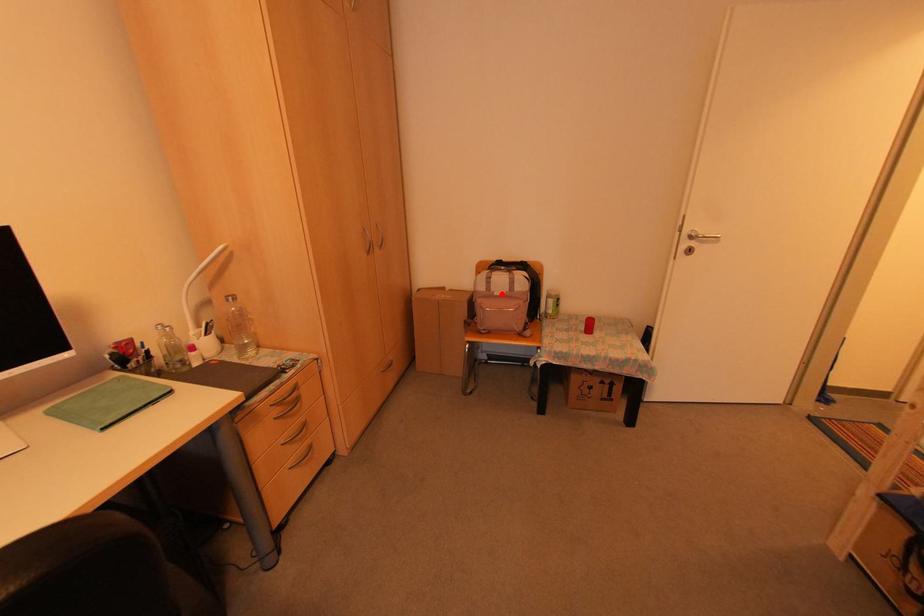
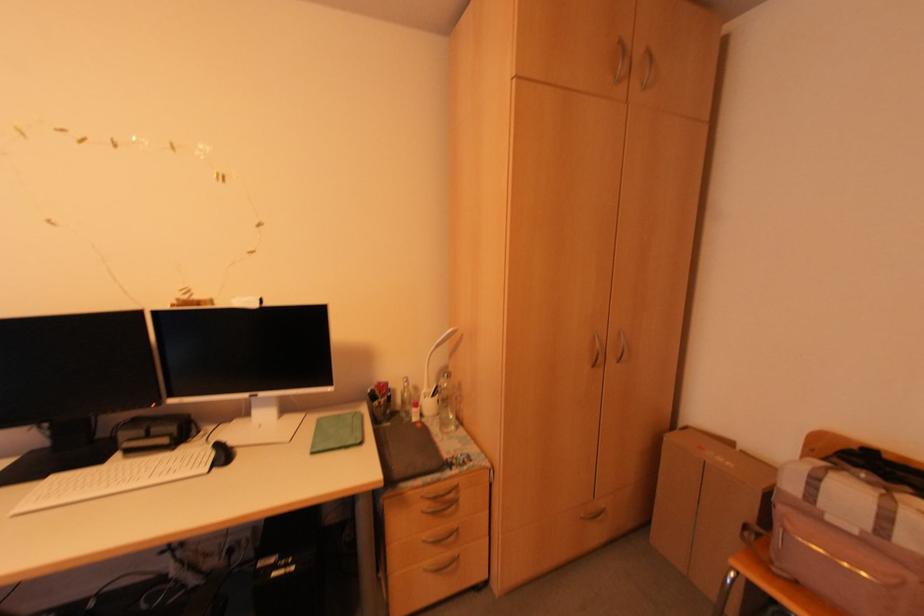
The point at the highlighted location is marked in the first image. Where is the corresponding point in the second image?

(854, 532)